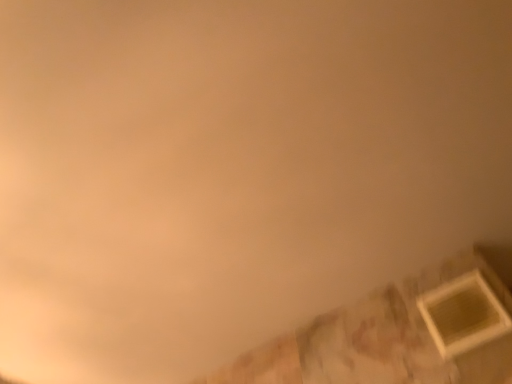
The height and width of the screenshot is (384, 512). What do you see at coordinates (464, 314) in the screenshot?
I see `wooden frame at lower right` at bounding box center [464, 314].

What are the coordinates of `wooden frame at lower right` in the screenshot? It's located at (464, 314).

What is the approximate width of wooden frame at lower right?

The width of wooden frame at lower right is 0.69 inches.

What are the coordinates of `wooden frame at lower right` in the screenshot? It's located at (464, 314).